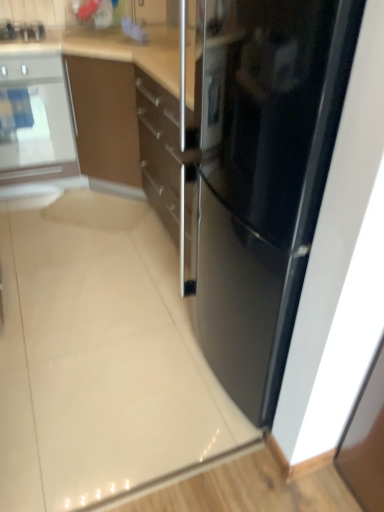
Where is `sleek stainless steel refrigerator at center`? The width and height of the screenshot is (384, 512). sleek stainless steel refrigerator at center is located at coordinates (267, 185).

Measure the distance between point (x=57, y=94) and camera.

Point (x=57, y=94) and camera are 7.77 feet apart from each other.

Identify the location of brushed metal toaster at upper left. Image resolution: width=384 pixels, height=512 pixels. (22, 31).

Where is `sleek stainless steel refrigerator at center`? sleek stainless steel refrigerator at center is located at coordinates (267, 185).

Does sleek stainless steel refrigerator at center have a smaller size compared to brushed metal toaster at upper left?

Incorrect, sleek stainless steel refrigerator at center is not smaller in size than brushed metal toaster at upper left.

From their relative heights in the image, would you say sleek stainless steel refrigerator at center is taller or shorter than brushed metal toaster at upper left?

Clearly, sleek stainless steel refrigerator at center is taller compared to brushed metal toaster at upper left.

From a real-world perspective, which is physically below, sleek stainless steel refrigerator at center or brushed metal toaster at upper left?

In real-world perspective, sleek stainless steel refrigerator at center is lower.

In the image, is satin silver oven at left on the left side or the right side of brushed metal toaster at upper left?

Clearly, satin silver oven at left is on the left of brushed metal toaster at upper left in the image.

Who is more distant, satin silver oven at left or brushed metal toaster at upper left?

Positioned behind is brushed metal toaster at upper left.

Is point (47, 113) positioned in front of point (41, 34)?

No, (47, 113) is behind (41, 34).

Is brushed metal toaster at upper left further to the viewer compared to satin silver oven at left?

Yes, brushed metal toaster at upper left is behind satin silver oven at left.

Is brushed metal toaster at upper left thinner than satin silver oven at left?

Yes, brushed metal toaster at upper left is thinner than satin silver oven at left.

Would you say brushed metal toaster at upper left is outside satin silver oven at left?

No, brushed metal toaster at upper left is inside or overlapping with satin silver oven at left.

Considering the relative positions of brushed metal toaster at upper left and satin silver oven at left in the image provided, is brushed metal toaster at upper left to the left of satin silver oven at left from the viewer's perspective?

Incorrect, brushed metal toaster at upper left is not on the left side of satin silver oven at left.

Measure the distance between satin silver oven at left and sleek stainless steel refrigerator at center.

They are 1.61 meters apart.

From a real-world perspective, between satin silver oven at left and sleek stainless steel refrigerator at center, who is vertically lower?

In real-world perspective, sleek stainless steel refrigerator at center is lower.

Is satin silver oven at left positioned with its back to sleek stainless steel refrigerator at center?

satin silver oven at left does not have its back to sleek stainless steel refrigerator at center.

The height and width of the screenshot is (512, 384). I want to click on refrigerator below the satin silver oven at left (from the image's perspective), so click(267, 185).

From the image's perspective, which is below, sleek stainless steel refrigerator at center or satin silver oven at left?

sleek stainless steel refrigerator at center is shown below in the image.

Is point (290, 198) positioned behind point (0, 91)?

No, (290, 198) is closer to viewer.

Considering the sizes of objects sleek stainless steel refrigerator at center and satin silver oven at left in the image provided, who is thinner, sleek stainless steel refrigerator at center or satin silver oven at left?

satin silver oven at left.

Is sleek stainless steel refrigerator at center facing away from satin silver oven at left?

That's not correct — sleek stainless steel refrigerator at center is not looking away from satin silver oven at left.

Can you tell me how much brushed metal toaster at upper left and sleek stainless steel refrigerator at center differ in facing direction?

The angle between the facing direction of brushed metal toaster at upper left and the facing direction of sleek stainless steel refrigerator at center is 90.3 degrees.

Can you confirm if brushed metal toaster at upper left is positioned to the right of sleek stainless steel refrigerator at center?

Incorrect, brushed metal toaster at upper left is not on the right side of sleek stainless steel refrigerator at center.

Is brushed metal toaster at upper left closer to camera compared to sleek stainless steel refrigerator at center?

No, it is not.

I want to click on appliance above the sleek stainless steel refrigerator at center (from the image's perspective), so click(22, 31).

What are the coordinates of `home appliance lying below the brushed metal toaster at upper left (from the image's perspective)` in the screenshot? It's located at (35, 120).

Based on their spatial positions, is satin silver oven at left or sleek stainless steel refrigerator at center closer to brushed metal toaster at upper left?

The object closer to brushed metal toaster at upper left is satin silver oven at left.

Which object lies further to the anchor point sleek stainless steel refrigerator at center, satin silver oven at left or brushed metal toaster at upper left?

Among the two, brushed metal toaster at upper left is located further to sleek stainless steel refrigerator at center.

When comparing their distances from satin silver oven at left, does brushed metal toaster at upper left or sleek stainless steel refrigerator at center seem closer?

brushed metal toaster at upper left lies closer to satin silver oven at left than the other object.

When comparing their distances from satin silver oven at left, does sleek stainless steel refrigerator at center or brushed metal toaster at upper left seem further?

The object further to satin silver oven at left is sleek stainless steel refrigerator at center.

Looking at the image, which one is located closer to brushed metal toaster at upper left, sleek stainless steel refrigerator at center or satin silver oven at left?

Among the two, satin silver oven at left is located nearer to brushed metal toaster at upper left.

Considering their positions, is brushed metal toaster at upper left positioned closer to sleek stainless steel refrigerator at center than satin silver oven at left?

satin silver oven at left lies closer to sleek stainless steel refrigerator at center than the other object.

The image size is (384, 512). Identify the location of appliance between satin silver oven at left and sleek stainless steel refrigerator at center. (22, 31).